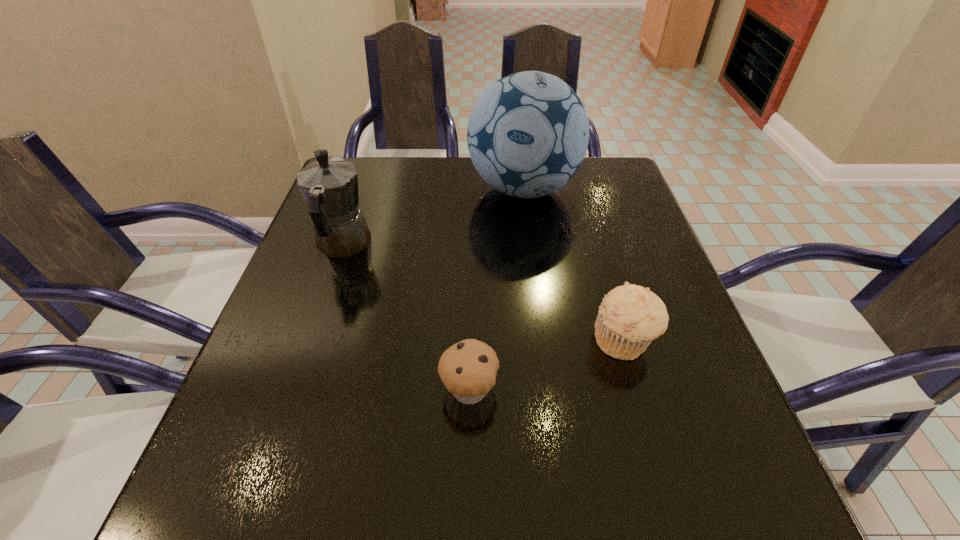
Locate an element on the screen. This screenshot has width=960, height=540. free space located 0.210m on the pouring side of the third shortest object is located at coordinates (368, 173).

I want to click on vacant space located 0.210m on the front of the third tallest object, so click(x=669, y=494).

You are a GUI agent. You are given a task and a screenshot of the screen. Output one action in this format:
    pyautogui.click(x=<x>, y=<y>)
    Task: Click on the vacant space located on the back of the left muffin
    The height and width of the screenshot is (540, 960).
    Given the screenshot: What is the action you would take?
    pyautogui.click(x=471, y=268)

Identify the location of object that is at the far edge. (528, 133).

Find the location of `object at the left edge`. object at the left edge is located at coordinates (330, 186).

Locate an element on the screen. The width and height of the screenshot is (960, 540). soccer ball that is at the right edge is located at coordinates (528, 133).

Image resolution: width=960 pixels, height=540 pixels. What are the coordinates of `muffin that is at the right edge` in the screenshot? It's located at (630, 316).

Image resolution: width=960 pixels, height=540 pixels. In order to click on object at the far right corner in this screenshot , I will do `click(528, 133)`.

In the image, there is a desktop. In order to click on vacant area at the far edge in this screenshot , I will do `click(442, 184)`.

Locate an element on the screen. The image size is (960, 540). vacant area at the near edge of the desktop is located at coordinates (394, 485).